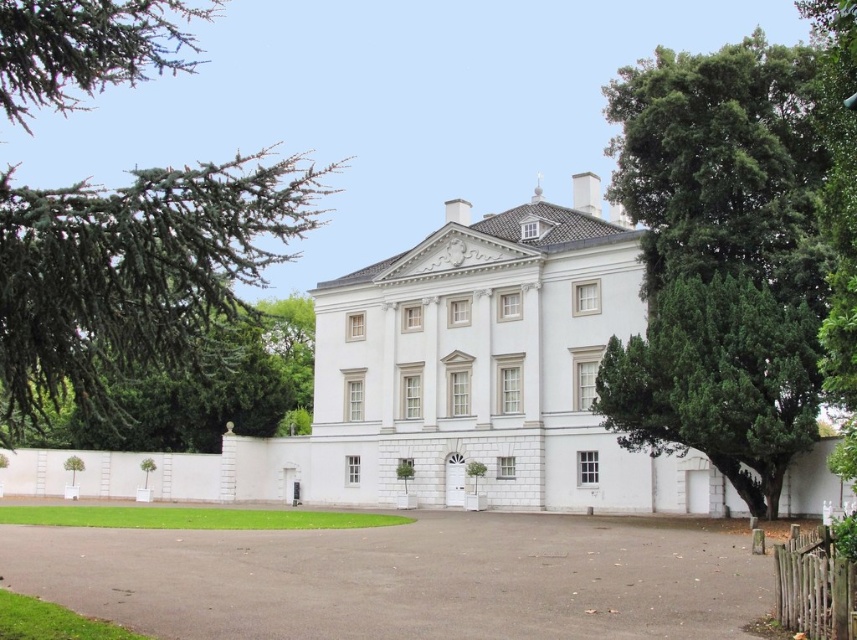
Question: Can you confirm if green needle-like branches at upper left is positioned above green leafy tree at right?

Choices:
 (A) no
 (B) yes

Answer: (B)

Question: Estimate the real-world distances between objects in this image. Which object is farther from the gray asphalt driveway at lower center?

Choices:
 (A) green needle-like branches at upper left
 (B) green leafy tree at right

Answer: (A)

Question: Which point is closer to the camera?

Choices:
 (A) (735, 312)
 (B) (592, 525)
 (C) (232, 195)
 (D) (598, 378)

Answer: (C)

Question: Which object appears farthest from the camera in this image?

Choices:
 (A) gray asphalt driveway at lower center
 (B) green needle-like branches at upper left
 (C) green leafy tree at right
 (D) green textured tree at right

Answer: (D)

Question: Observing the image, what is the correct spatial positioning of gray asphalt driveway at lower center in reference to green leafy tree at right?

Choices:
 (A) above
 (B) below

Answer: (B)

Question: Can you confirm if gray asphalt driveway at lower center is positioned to the left of green needle-like branches at upper left?

Choices:
 (A) no
 (B) yes

Answer: (A)